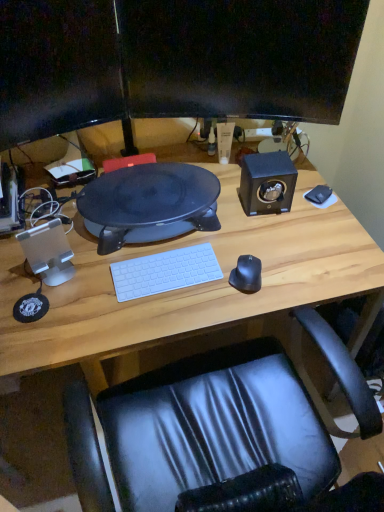
You are a GUI agent. You are given a task and a screenshot of the screen. Output one action in this format:
    pyautogui.click(x=<x>, y=<y>)
    Task: Click on the free space above white matte keyboard at center (from a real-world perspective)
    This screenshot has height=512, width=384.
    Given the screenshot: What is the action you would take?
    pyautogui.click(x=163, y=268)